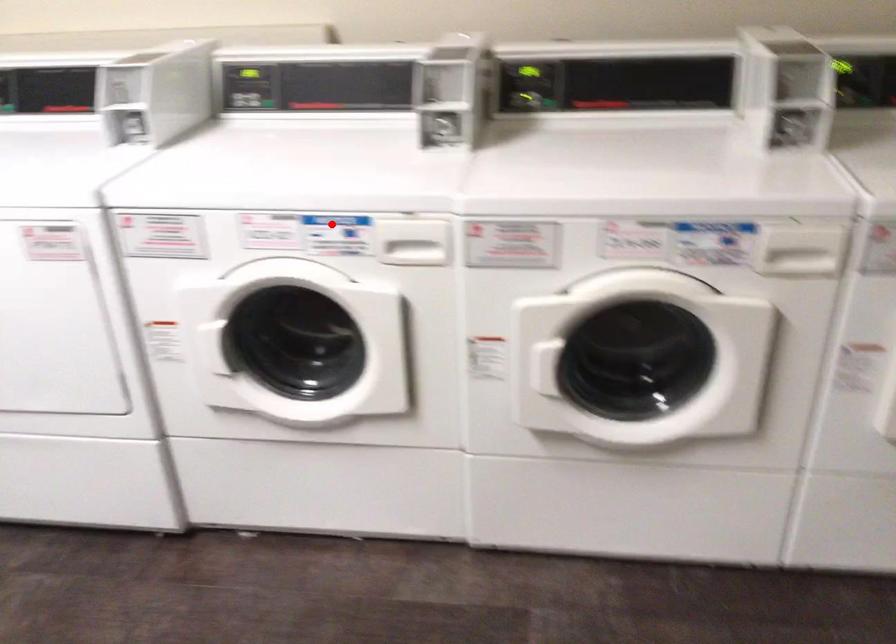
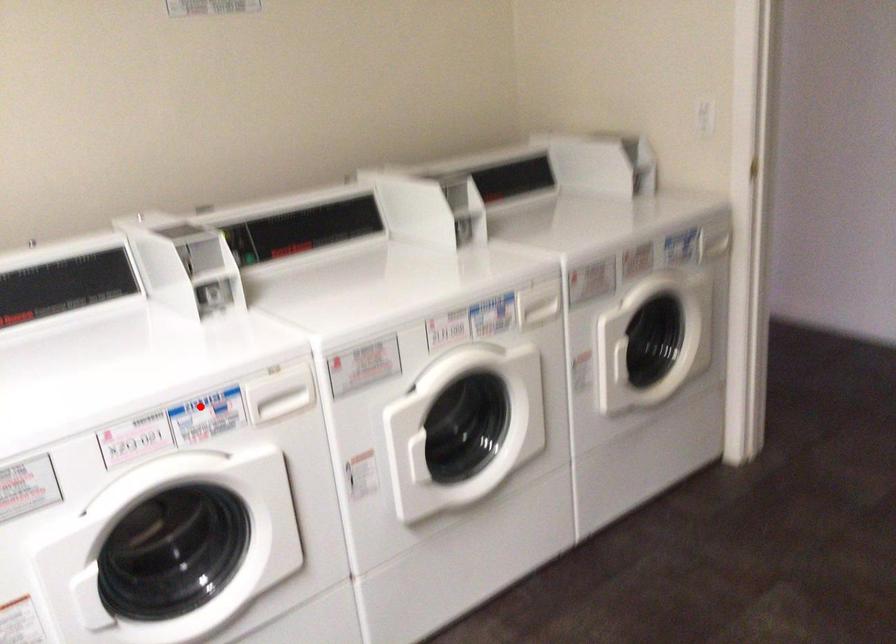
I am providing you with two images of the same scene from different viewpoints. A red point is marked on the first image and another point is marked on the second image. Do the highlighted points in image1 and image2 indicate the same real-world spot?

Yes